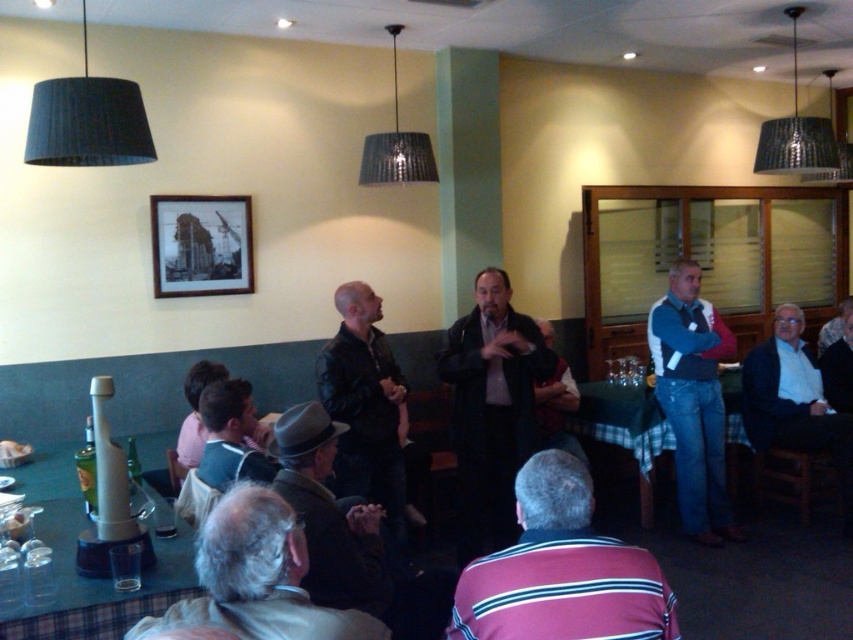
Which of these two, white cotton shirt at lower right or black wood picture frame at upper center, stands taller?

white cotton shirt at lower right is taller.

Does white cotton shirt at lower right have a lesser height compared to black wood picture frame at upper center?

In fact, white cotton shirt at lower right may be taller than black wood picture frame at upper center.

Between point (775, 432) and point (225, 280), which one is positioned in front?

Point (225, 280) is in front.

Where is `white cotton shirt at lower right`? white cotton shirt at lower right is located at coordinates (793, 403).

Is gray woolen sweater at lower left taller than plastic/transparent glasses at lower left?

Yes, gray woolen sweater at lower left is taller than plastic/transparent glasses at lower left.

Which of these two, gray woolen sweater at lower left or plastic/transparent glasses at lower left, stands taller?

gray woolen sweater at lower left is taller.

The height and width of the screenshot is (640, 853). Identify the location of gray woolen sweater at lower left. (257, 577).

Who is higher up, blue jeans at right or black leather jacket at center?

black leather jacket at center is above.

Is blue jeans at right closer to camera compared to black leather jacket at center?

No, blue jeans at right is behind black leather jacket at center.

In order to click on blue jeans at right in this screenshot , I will do `click(692, 403)`.

Find the location of a particular element. blue jeans at right is located at coordinates (692, 403).